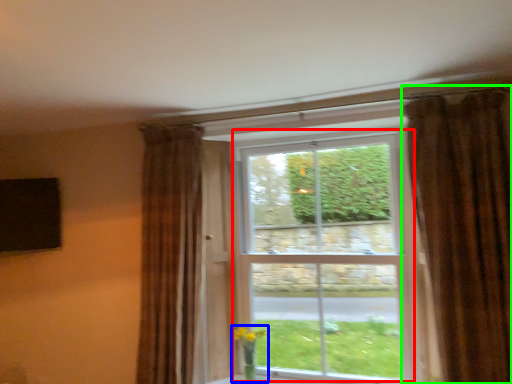
Question: Which is farther away from bay window (highlighted by a red box)? floral arrangement (highlighted by a blue box) or curtain (highlighted by a green box)?

Choices:
 (A) floral arrangement
 (B) curtain

Answer: (A)